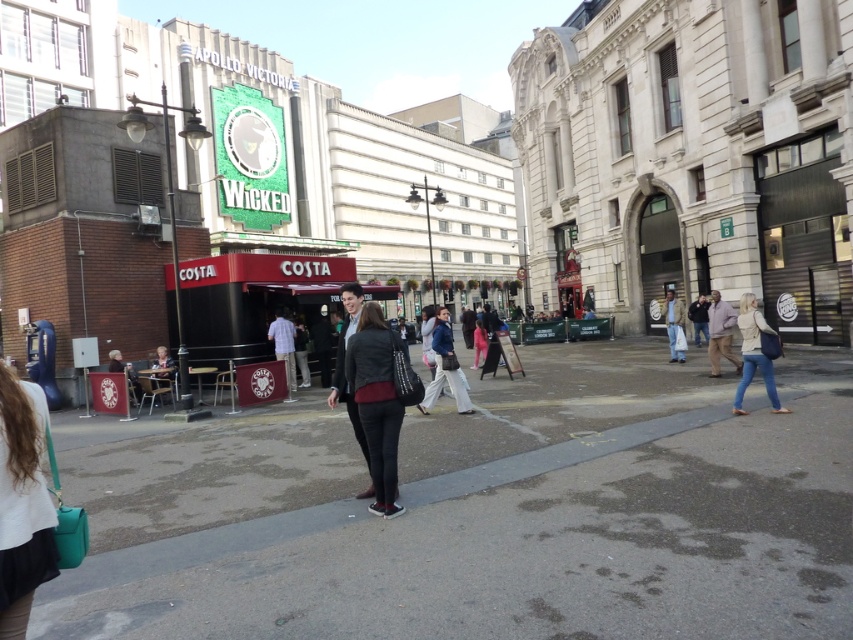
You are standing on the sidewalk and see the matte black costa coffee shop at center and the matte black jacket at center. Which object is positioned to the right of the other?

The matte black costa coffee shop at center is to the right of the matte black jacket at center.

Looking at this image, you are a photographer trying to capture a candid shot of the matte black jacket at center without including the light beige sweater at lower right in the frame. Based on their positions, is this possible?

The matte black jacket at center is positioned under the light beige sweater at lower right, so it might be challenging to capture the matte black jacket at center without including the light beige sweater at lower right in the frame.

You are standing at the point marked as point [428,177] in the image. What is the nearest landmark or business to your current location?

The point [428,177] corresponds to the matte black Costa Coffee shop at center, so the nearest landmark or business to your current location is the matte black Costa Coffee shop at center.